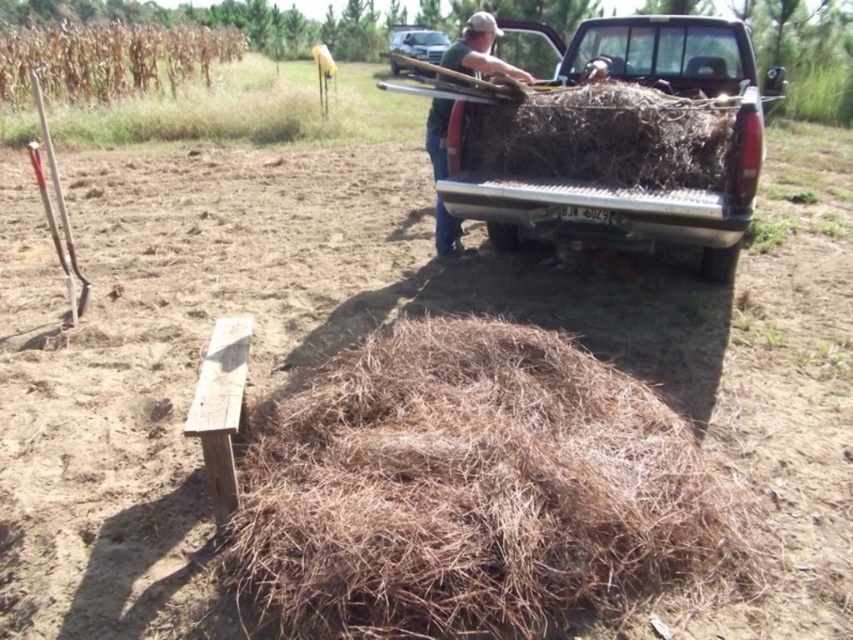
Locate an element on the screen. brown dry hay at rear is located at coordinates (602, 138).

Is brown dry hay at rear positioned at the back of green cotton shirt at upper center?

No, brown dry hay at rear is in front of green cotton shirt at upper center.

Is point (625, 112) less distant than point (460, 221)?

Yes, point (625, 112) is in front of point (460, 221).

The image size is (853, 640). I want to click on brown dry hay at rear, so (602, 138).

Is point (366, 339) in front of point (688, 99)?

Yes, point (366, 339) is in front of point (688, 99).

Locate an element on the screen. The image size is (853, 640). brown dry hay at center is located at coordinates (473, 490).

Where is `brown dry hay at center`? brown dry hay at center is located at coordinates (473, 490).

Can you confirm if metallic silver truck at upper right is shorter than brown dry hay at rear?

In fact, metallic silver truck at upper right may be taller than brown dry hay at rear.

Does metallic silver truck at upper right come in front of brown dry hay at rear?

Yes, it is.

This screenshot has width=853, height=640. What are the coordinates of `metallic silver truck at upper right` in the screenshot? It's located at (610, 179).